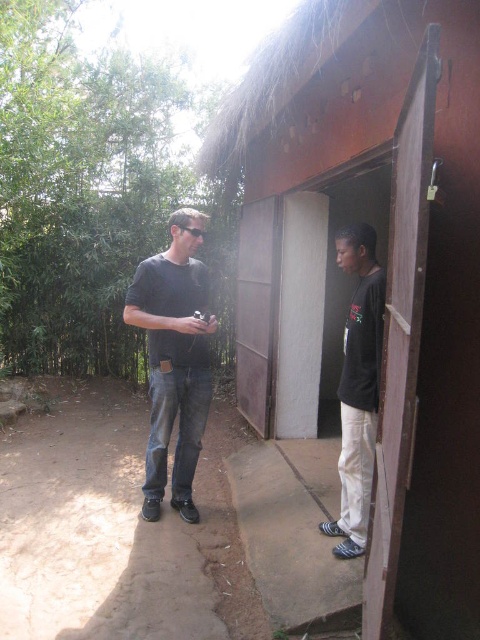
Consider the image. Is brown wooden hut at center wider than denim jeans at center?

Yes, brown wooden hut at center is wider than denim jeans at center.

Can you confirm if brown wooden hut at center is shorter than denim jeans at center?

No.

Describe the element at coordinates (383, 266) in the screenshot. I see `brown wooden hut at center` at that location.

Identify the location of brown wooden hut at center. (383, 266).

This screenshot has height=640, width=480. Find the location of `denim jeans at center`. denim jeans at center is located at coordinates (173, 358).

Does denim jeans at center appear under black matte shirt at center?

No, denim jeans at center is not below black matte shirt at center.

Where is `denim jeans at center`? This screenshot has width=480, height=640. denim jeans at center is located at coordinates (173, 358).

The width and height of the screenshot is (480, 640). What do you see at coordinates (383, 266) in the screenshot?
I see `brown wooden hut at center` at bounding box center [383, 266].

Find the location of a particular element. Image resolution: width=480 pixels, height=640 pixels. brown wooden hut at center is located at coordinates (383, 266).

I want to click on brown wooden hut at center, so 383,266.

Locate an element on the screen. brown wooden hut at center is located at coordinates (383, 266).